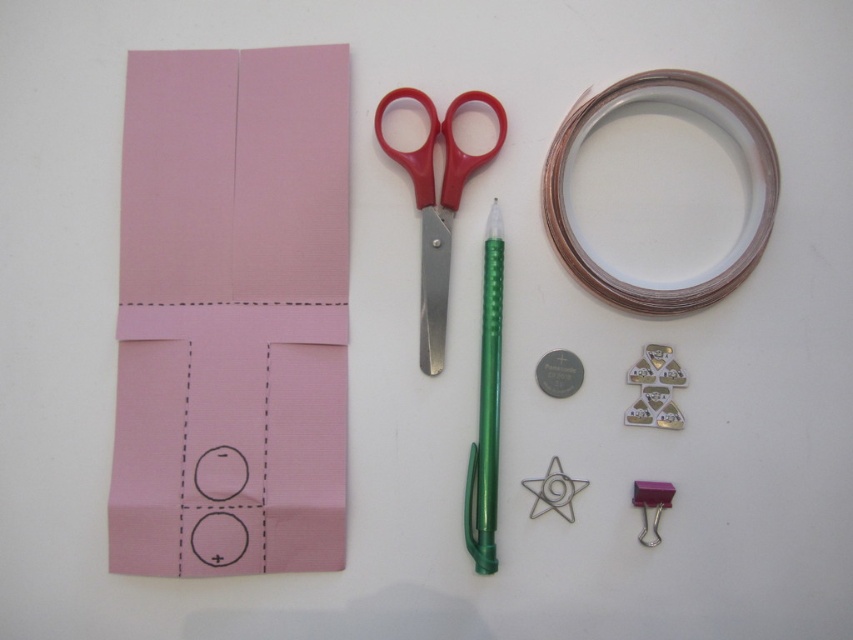
Is transparent plastic ring at upper center taller than pink plastic binder clip at lower right?

Yes, transparent plastic ring at upper center is taller than pink plastic binder clip at lower right.

Is transparent plastic ring at upper center above pink plastic binder clip at lower right?

Yes, transparent plastic ring at upper center is above pink plastic binder clip at lower right.

Does point (680, 292) come behind point (664, 506)?

Yes, point (680, 292) is farther from viewer.

Find the location of a particular element. The width and height of the screenshot is (853, 640). transparent plastic ring at upper center is located at coordinates (746, 177).

Does transparent plastic ring at upper center come in front of red plastic scissors at center?

That is True.

Does transparent plastic ring at upper center have a smaller size compared to red plastic scissors at center?

No, transparent plastic ring at upper center is not smaller than red plastic scissors at center.

Locate an element on the screen. The width and height of the screenshot is (853, 640). transparent plastic ring at upper center is located at coordinates (746, 177).

Does pink paper at left have a lesser width compared to pink plastic binder clip at lower right?

Incorrect, pink paper at left's width is not less than pink plastic binder clip at lower right's.

Looking at this image, does pink paper at left appear under pink plastic binder clip at lower right?

No, pink paper at left is not below pink plastic binder clip at lower right.

This screenshot has height=640, width=853. Find the location of `pink paper at left`. pink paper at left is located at coordinates (231, 314).